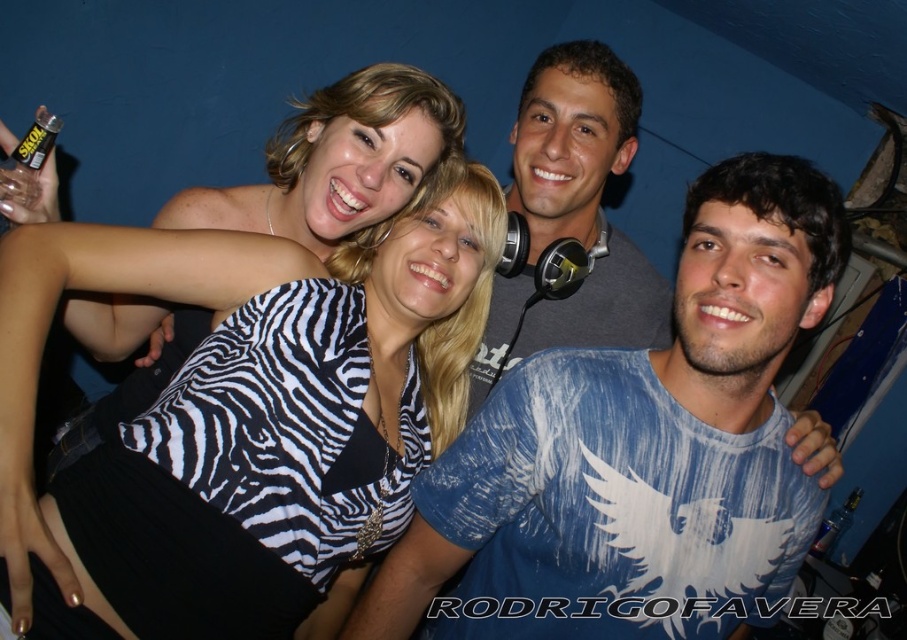
Question: Which is nearer to the gray matte headphones at center?

Choices:
 (A) transparent plastic bottle at upper left
 (B) zebra print top at center

Answer: (B)

Question: Is zebra print top at center to the right of blue cotton t-shirt at center from the viewer's perspective?

Choices:
 (A) no
 (B) yes

Answer: (A)

Question: Which object is closer to the camera taking this photo?

Choices:
 (A) zebra print top at center
 (B) blue cotton t-shirt at center

Answer: (A)

Question: Based on their relative distances, which object is farther from the gray matte headphones at center?

Choices:
 (A) zebra print top at center
 (B) clear plastic bottle at lower right
 (C) transparent plastic bottle at upper left

Answer: (B)

Question: Considering the relative positions of blue cotton t-shirt at center and transparent plastic bottle at upper left in the image provided, where is blue cotton t-shirt at center located with respect to transparent plastic bottle at upper left?

Choices:
 (A) above
 (B) below

Answer: (B)

Question: Where is blue cotton t-shirt at center located in relation to transparent plastic bottle at upper left in the image?

Choices:
 (A) below
 (B) above

Answer: (A)